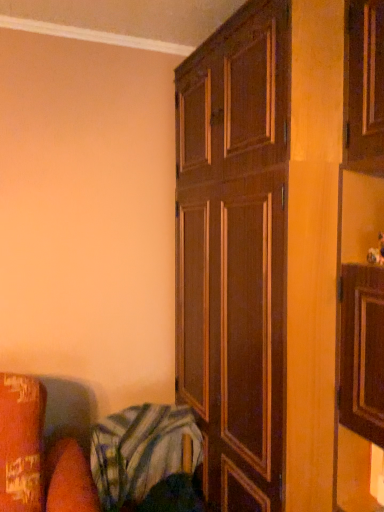
Question: Is striped cotton blanket at lower left positioned with its back to dark wood cupboard at center?

Choices:
 (A) no
 (B) yes

Answer: (A)

Question: From the image's perspective, is striped cotton blanket at lower left located beneath dark wood cupboard at center?

Choices:
 (A) no
 (B) yes

Answer: (B)

Question: Can you confirm if striped cotton blanket at lower left is smaller than dark wood cupboard at center?

Choices:
 (A) yes
 (B) no

Answer: (A)

Question: Is striped cotton blanket at lower left bigger than dark wood cupboard at center?

Choices:
 (A) yes
 (B) no

Answer: (B)

Question: Is striped cotton blanket at lower left shorter than dark wood cupboard at center?

Choices:
 (A) no
 (B) yes

Answer: (B)

Question: Can you confirm if striped cotton blanket at lower left is positioned to the right of dark wood cupboard at center?

Choices:
 (A) no
 (B) yes

Answer: (A)

Question: Is dark wood cupboard at center facing away from striped cotton blanket at lower left?

Choices:
 (A) no
 (B) yes

Answer: (B)

Question: Could you tell me if dark wood cupboard at center is facing striped cotton blanket at lower left?

Choices:
 (A) yes
 (B) no

Answer: (A)

Question: Would you say dark wood cupboard at center is outside striped cotton blanket at lower left?

Choices:
 (A) no
 (B) yes

Answer: (B)

Question: Is dark wood cupboard at center directly adjacent to striped cotton blanket at lower left?

Choices:
 (A) yes
 (B) no

Answer: (B)

Question: From the image's perspective, is dark wood cupboard at center located beneath striped cotton blanket at lower left?

Choices:
 (A) no
 (B) yes

Answer: (A)

Question: From a real-world perspective, does dark wood cupboard at center stand above striped cotton blanket at lower left?

Choices:
 (A) yes
 (B) no

Answer: (A)

Question: Considering the positions of point (115, 474) and point (375, 193), is point (115, 474) closer or farther from the camera than point (375, 193)?

Choices:
 (A) farther
 (B) closer

Answer: (A)